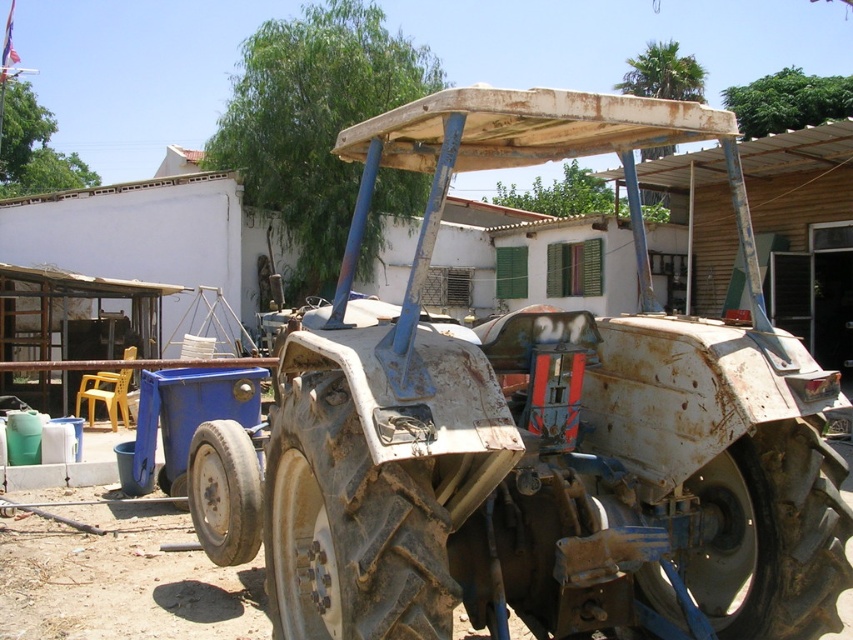
Question: Based on their relative distances, which object is farther from the dusty rubber tire at center?

Choices:
 (A) rusty metal tractor at center
 (B) rusty metal tire at lower center

Answer: (B)

Question: Is rusty metal tractor at center further to the viewer compared to rusty metal tire at lower center?

Choices:
 (A) no
 (B) yes

Answer: (A)

Question: Which point is farther from the camera taking this photo?

Choices:
 (A) (795, 531)
 (B) (316, 394)
 (C) (345, 419)

Answer: (A)

Question: Is dusty rubber tire at center to the right of rusty metal tire at lower right from the viewer's perspective?

Choices:
 (A) yes
 (B) no

Answer: (B)

Question: Which of the following is the farthest from the observer?

Choices:
 (A) (786, 632)
 (B) (183, 508)

Answer: (B)

Question: Can you confirm if rusty metal tire at lower right is positioned to the right of rusty metal tire at lower center?

Choices:
 (A) no
 (B) yes

Answer: (B)